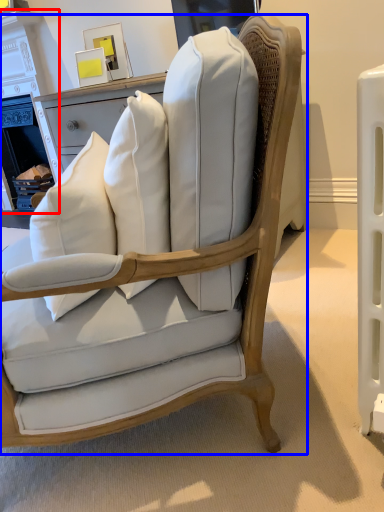
Question: Among these objects, which one is farthest to the camera, fireplace (highlighted by a red box) or chair (highlighted by a blue box)?

Choices:
 (A) fireplace
 (B) chair

Answer: (A)